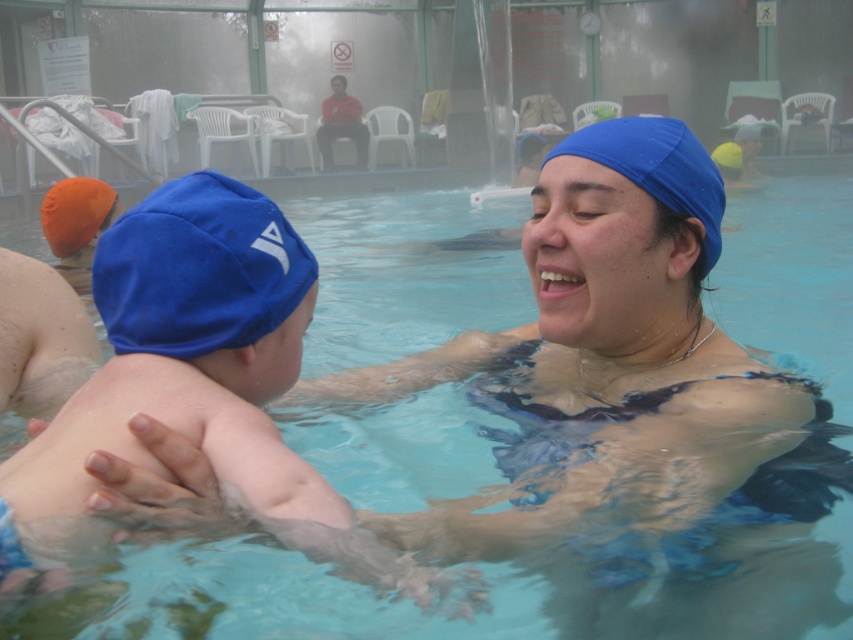
Who is more distant from viewer, (103, 282) or (631, 148)?

The point (631, 148) is behind.

In the scene shown: Does blue fleece swim cap at left have a lesser width compared to blue fabric swim cap at center?

Indeed, blue fleece swim cap at left has a lesser width compared to blue fabric swim cap at center.

Measure the distance between point [178,348] and camera.

Point [178,348] and camera are 35.27 inches apart.

The width and height of the screenshot is (853, 640). What are the coordinates of `blue fleece swim cap at left` in the screenshot? It's located at (198, 269).